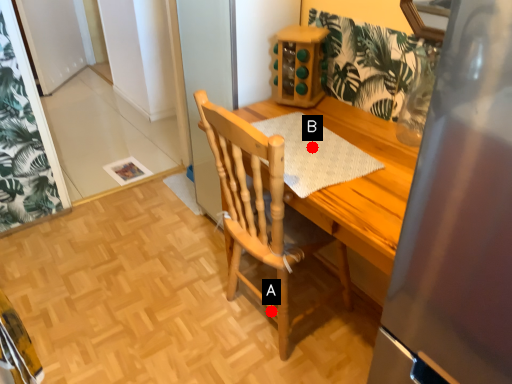
Question: Two points are circled on the image, labeled by A and B beside each circle. Which point is farther from the camera taking this photo?

Choices:
 (A) A is further
 (B) B is further

Answer: (A)